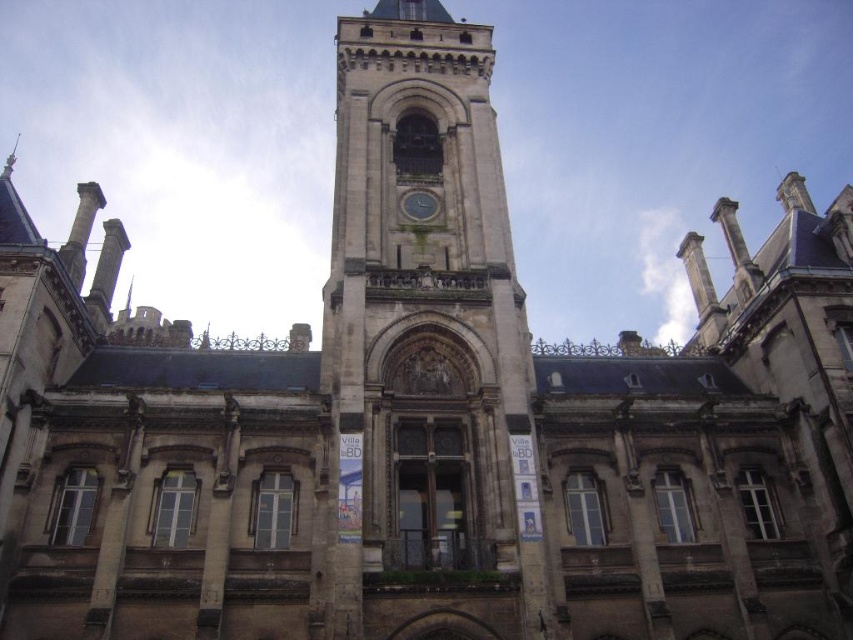
Is the position of brown stone clock tower at center more distant than that of green glass clock at center?

No.

Is point (431, 44) in front of point (431, 211)?

No.

The image size is (853, 640). In order to click on brown stone clock tower at center in this screenshot , I will do `click(425, 349)`.